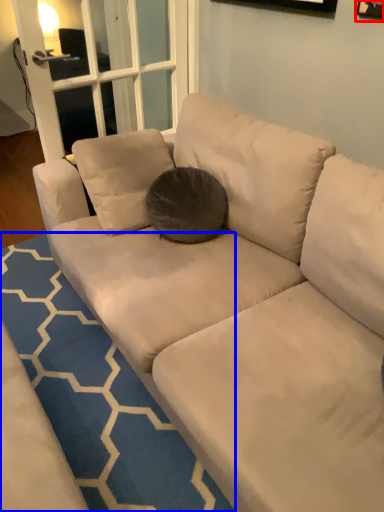
Question: Which object appears farthest to the camera in this image, picture frame (highlighted by a red box) or doormat (highlighted by a blue box)?

Choices:
 (A) picture frame
 (B) doormat

Answer: (A)